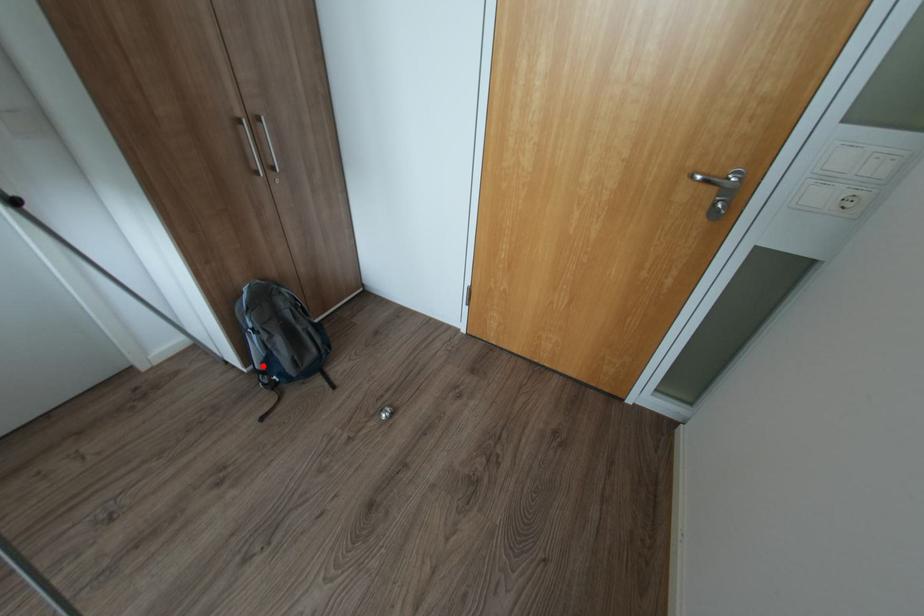
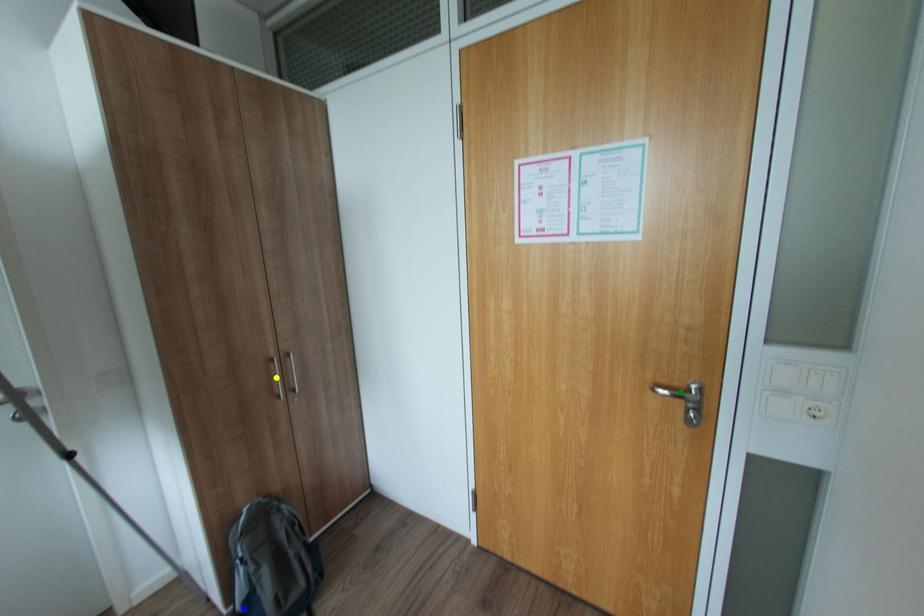
Question: I am providing you with two images of the same scene from different viewpoints. A red point is marked on the first image. You are given multiple points on the second image. Can you choose the point in image 2 that corresponds to the point in image 1?

Choices:
 (A) green point
 (B) yellow point
 (C) blue point

Answer: (C)